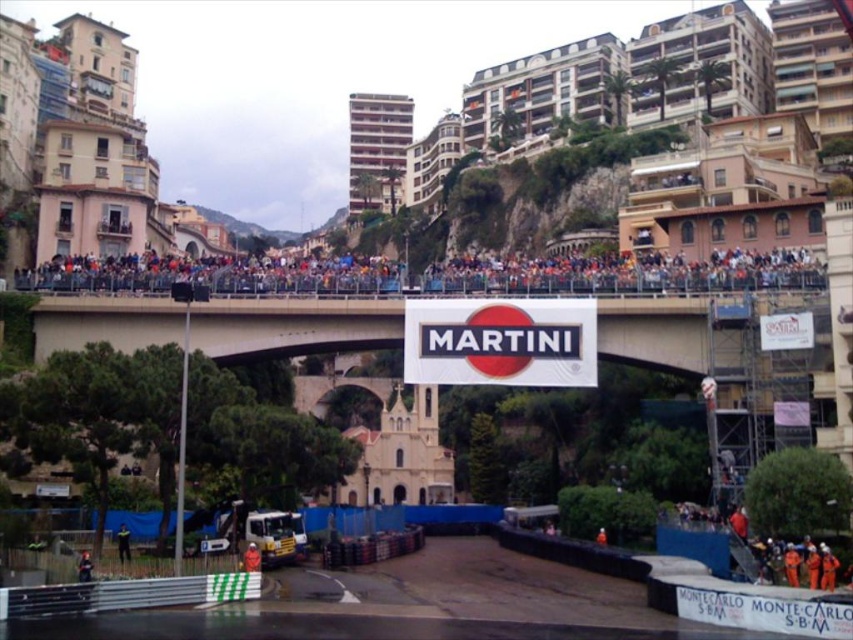
Question: Can you confirm if orange fabric person at center is smaller than dark red helmet at lower left?

Choices:
 (A) yes
 (B) no

Answer: (A)

Question: Which is farther from the white concrete bridge at center?

Choices:
 (A) white matte sign at center
 (B) green fabric jacket at lower left

Answer: (B)

Question: Which of the following is the closest to the observer?

Choices:
 (A) green fabric jacket at lower left
 (B) white matte sign at center
 (C) multicolored fabric crowd at upper center
 (D) dark red helmet at lower left

Answer: (D)

Question: Among these points, which one is nearest to the camera?

Choices:
 (A) (126, 541)
 (B) (407, 326)
 (C) (90, 570)

Answer: (C)

Question: Is white matte sign at center to the left of dark red helmet at lower left from the viewer's perspective?

Choices:
 (A) yes
 (B) no

Answer: (B)

Question: Can you confirm if orange fabric person at center is bigger than green fabric jacket at lower left?

Choices:
 (A) no
 (B) yes

Answer: (A)